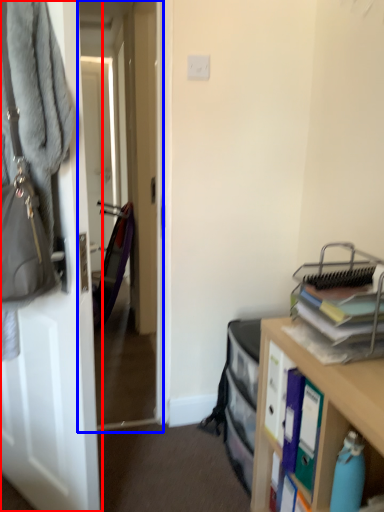
Question: Which of the following is the farthest to the observer, door (highlighted by a red box) or passage (highlighted by a blue box)?

Choices:
 (A) door
 (B) passage

Answer: (B)